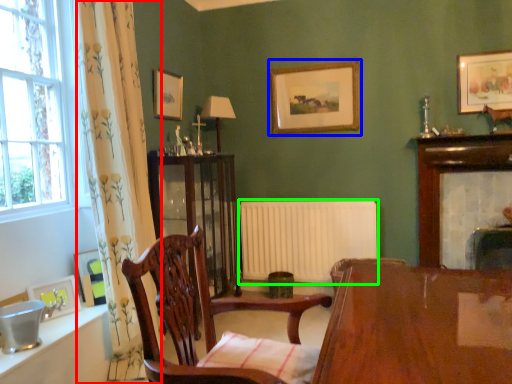
Question: Based on their relative distances, which object is farther from curtain (highlighted by a red box)? Choose from picture frame (highlighted by a blue box) and radiator (highlighted by a green box).

Choices:
 (A) picture frame
 (B) radiator

Answer: (A)